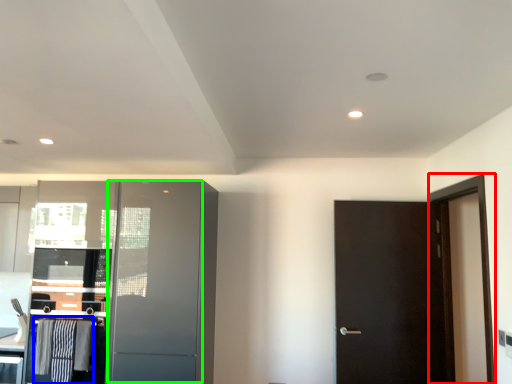
Question: Which object is the closest to the screen door (highlighted by a red box)? Choose among these: laundry (highlighted by a blue box) or screen door (highlighted by a green box).

Choices:
 (A) laundry
 (B) screen door

Answer: (B)